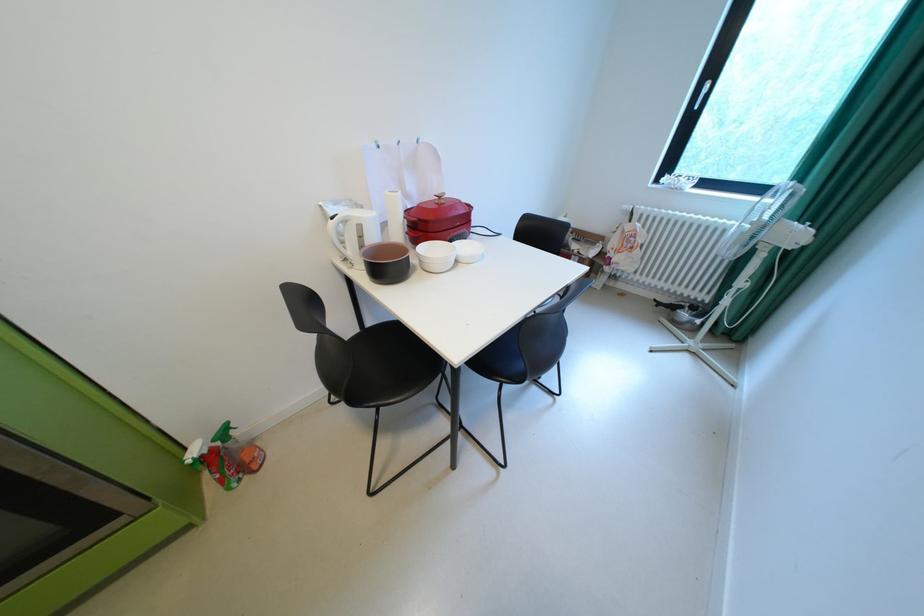
Where is `white kettle handle`? Image resolution: width=924 pixels, height=616 pixels. white kettle handle is located at coordinates (354, 233).